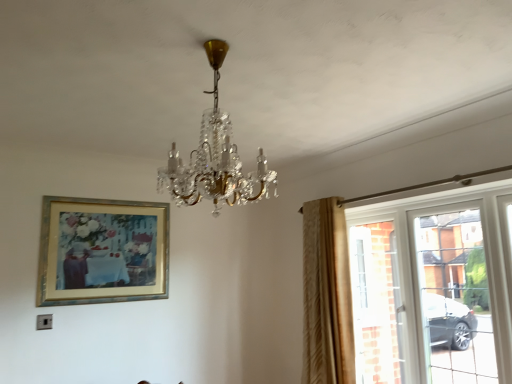
Question: Does crystal glass chandelier at center lie in front of gold metallic picture frame at upper left?

Choices:
 (A) no
 (B) yes

Answer: (B)

Question: Is crystal glass chandelier at center shorter than gold metallic picture frame at upper left?

Choices:
 (A) yes
 (B) no

Answer: (A)

Question: Does crystal glass chandelier at center have a larger size compared to gold metallic picture frame at upper left?

Choices:
 (A) no
 (B) yes

Answer: (B)

Question: Is crystal glass chandelier at center directly adjacent to gold metallic picture frame at upper left?

Choices:
 (A) yes
 (B) no

Answer: (B)

Question: From the image's perspective, does crystal glass chandelier at center appear higher than gold metallic picture frame at upper left?

Choices:
 (A) no
 (B) yes

Answer: (B)

Question: From a real-world perspective, is crystal glass chandelier at center below gold metallic picture frame at upper left?

Choices:
 (A) yes
 (B) no

Answer: (B)

Question: Considering the relative sizes of crystal glass chandelier at center and beige textured curtain at right in the image provided, is crystal glass chandelier at center taller than beige textured curtain at right?

Choices:
 (A) yes
 (B) no

Answer: (B)

Question: Does crystal glass chandelier at center have a greater width compared to beige textured curtain at right?

Choices:
 (A) yes
 (B) no

Answer: (A)

Question: Is crystal glass chandelier at center further to camera compared to beige textured curtain at right?

Choices:
 (A) yes
 (B) no

Answer: (B)

Question: Is crystal glass chandelier at center not inside beige textured curtain at right?

Choices:
 (A) yes
 (B) no

Answer: (A)

Question: Considering the relative sizes of crystal glass chandelier at center and beige textured curtain at right in the image provided, is crystal glass chandelier at center thinner than beige textured curtain at right?

Choices:
 (A) yes
 (B) no

Answer: (B)

Question: From the image's perspective, is crystal glass chandelier at center beneath beige textured curtain at right?

Choices:
 (A) yes
 (B) no

Answer: (B)

Question: Does gold metallic picture frame at upper left have a greater width compared to beige textured curtain at right?

Choices:
 (A) no
 (B) yes

Answer: (A)